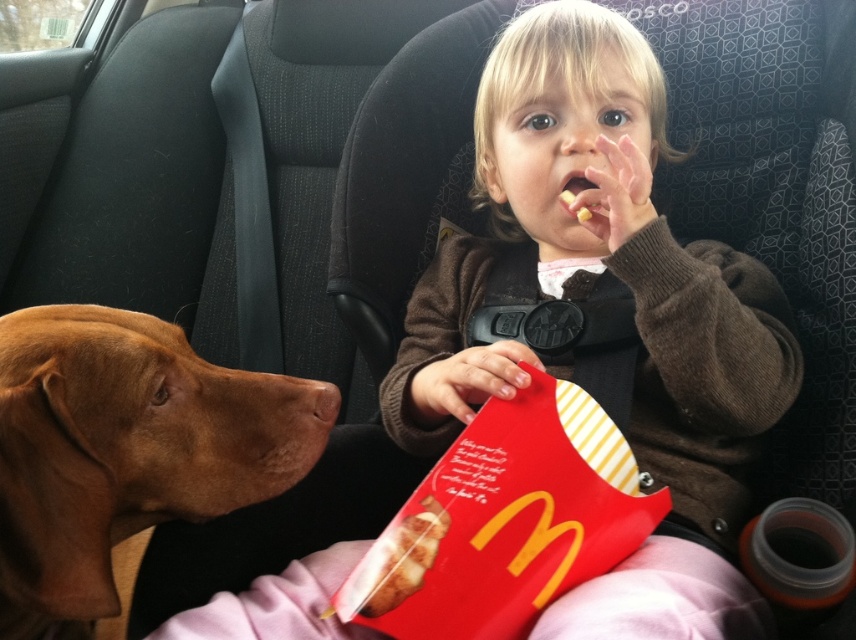
You are a photographer trying to capture a closeup shot of the child and the dog in the car. The camera is positioned at a point that is 25.00 inches away from the point at coordinates point (268, 451). Is the camera close enough to capture both the child and the dog clearly in the shot?

The camera is positioned 25.00 inches away from the point at coordinates point (268, 451), which is close enough to capture both the child and the dog clearly in the shot.

You are a passenger in the car and want to reach for the snack the child is holding. The snack is located at point (x=159, y=497). However, there is an obstacle at point (x=581, y=211). Can you safely reach the snack without touching the obstacle?

Point (x=159, y=497) is in front of point (x=581, y=211), so you can safely reach the snack at point (x=159, y=497) without touching the obstacle at point (x=581, y=211).

You are a parent in the driver seat. You see the brown fur at left and the yellow matte snack at center. Which one is closer to the left side of the car?

The brown fur at left is closer to the left side of the car because it is positioned to the left of the yellow matte snack at center.